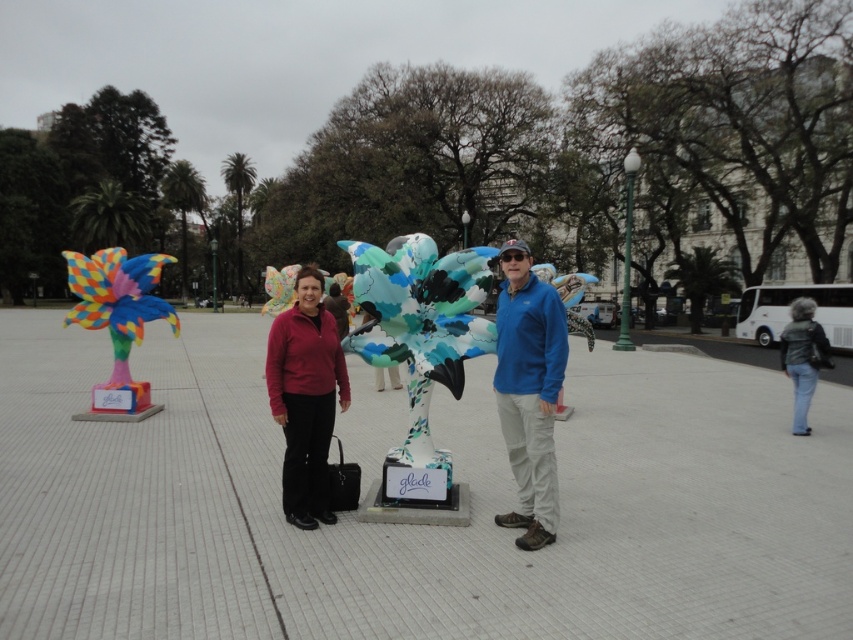
In the scene shown: You are a photographer wanting to capture both the blue fleece jacket at center and the multicolored painted bird at left in the same frame. Which object should you focus on first to ensure both are in focus?

Since the blue fleece jacket at center is thinner than the multicolored painted bird at left, you should focus on the multicolored painted bird at left first to ensure both are in focus.

Looking at this image, you are a photographer standing in the public square. You need to capture a photo that includes both the blue fleece jacket at center and the multicolored painted bird at left. Based on their sizes, which object should you focus on first to ensure both fit in the frame?

The blue fleece jacket at center is smaller than the multicolored painted bird at left. To ensure both fit in the frame, focus on positioning the camera to accommodate the larger multicolored painted bird at left first, then adjust to include the smaller blue fleece jacket at center.